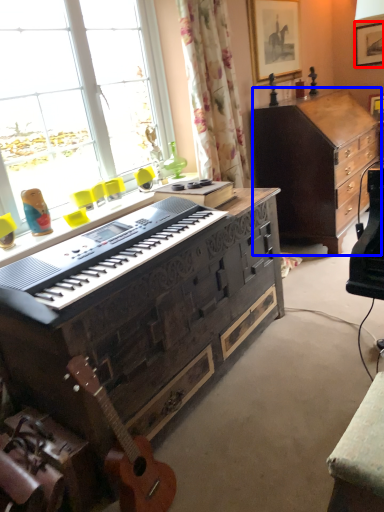
Question: Which object is further to the camera taking this photo, picture frame (highlighted by a red box) or cabinetry (highlighted by a blue box)?

Choices:
 (A) picture frame
 (B) cabinetry

Answer: (A)